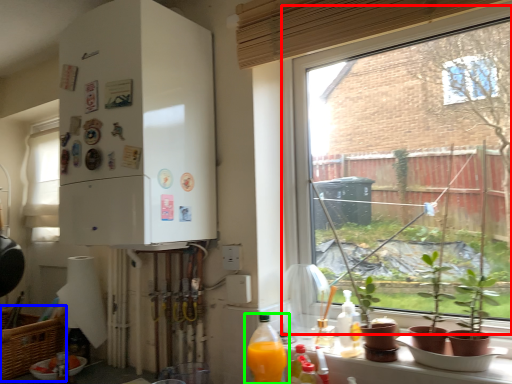
Question: Which object is the farthest from window (highlighted by a red box)? Choose among these: picnic basket (highlighted by a blue box) or bottle (highlighted by a green box).

Choices:
 (A) picnic basket
 (B) bottle

Answer: (A)